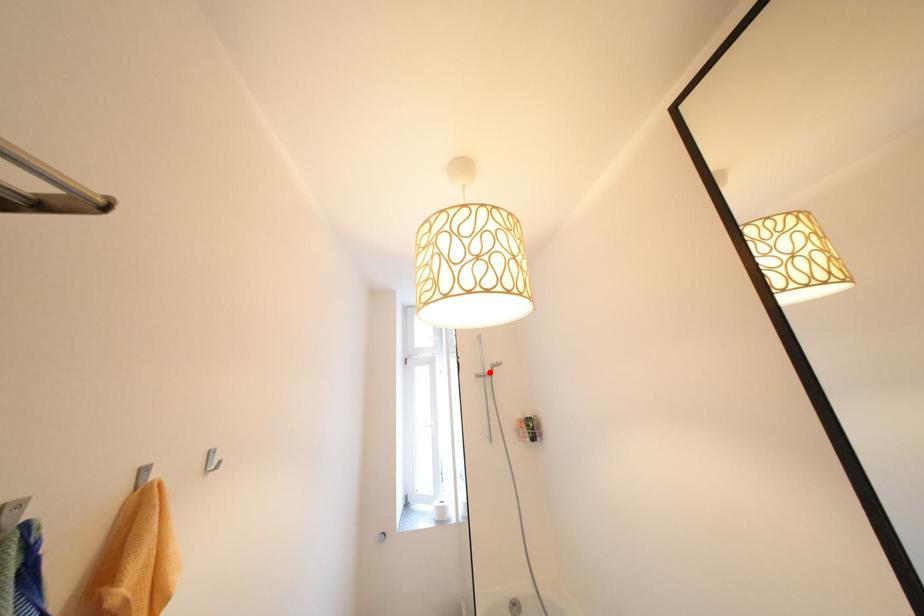
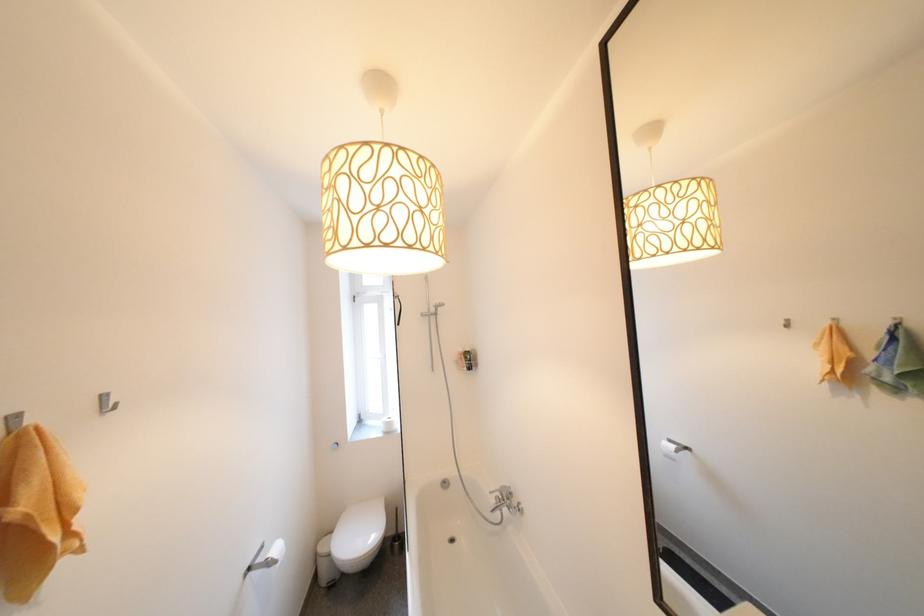
Find the pixel in the second image that matches the highlighted location in the first image.

(434, 312)